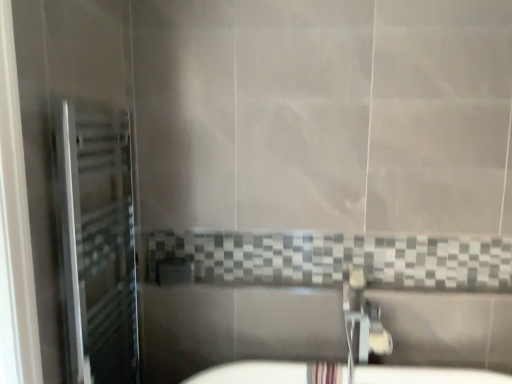
Question: From the image's perspective, is silver metallic towel rack at left below metallic chrome faucet at lower center?

Choices:
 (A) no
 (B) yes

Answer: (A)

Question: From a real-world perspective, is silver metallic towel rack at left beneath metallic chrome faucet at lower center?

Choices:
 (A) no
 (B) yes

Answer: (A)

Question: Can you confirm if silver metallic towel rack at left is shorter than metallic chrome faucet at lower center?

Choices:
 (A) no
 (B) yes

Answer: (A)

Question: Is silver metallic towel rack at left closer to camera compared to metallic chrome faucet at lower center?

Choices:
 (A) no
 (B) yes

Answer: (B)

Question: Is silver metallic towel rack at left smaller than metallic chrome faucet at lower center?

Choices:
 (A) yes
 (B) no

Answer: (B)

Question: Is silver metallic towel rack at left bigger than metallic chrome faucet at lower center?

Choices:
 (A) yes
 (B) no

Answer: (A)

Question: Considering the relative sizes of metallic chrome faucet at lower center and silver metallic towel rack at left in the image provided, is metallic chrome faucet at lower center bigger than silver metallic towel rack at left?

Choices:
 (A) yes
 (B) no

Answer: (B)

Question: Is metallic chrome faucet at lower center positioned before silver metallic towel rack at left?

Choices:
 (A) yes
 (B) no

Answer: (B)

Question: Is metallic chrome faucet at lower center far from silver metallic towel rack at left?

Choices:
 (A) yes
 (B) no

Answer: (A)

Question: Would you say metallic chrome faucet at lower center is outside silver metallic towel rack at left?

Choices:
 (A) no
 (B) yes

Answer: (B)

Question: Does metallic chrome faucet at lower center touch silver metallic towel rack at left?

Choices:
 (A) no
 (B) yes

Answer: (A)

Question: Is metallic chrome faucet at lower center at the left side of silver metallic towel rack at left?

Choices:
 (A) no
 (B) yes

Answer: (A)

Question: Relative to metallic chrome faucet at lower center, is silver metallic towel rack at left in front or behind?

Choices:
 (A) behind
 (B) front

Answer: (B)